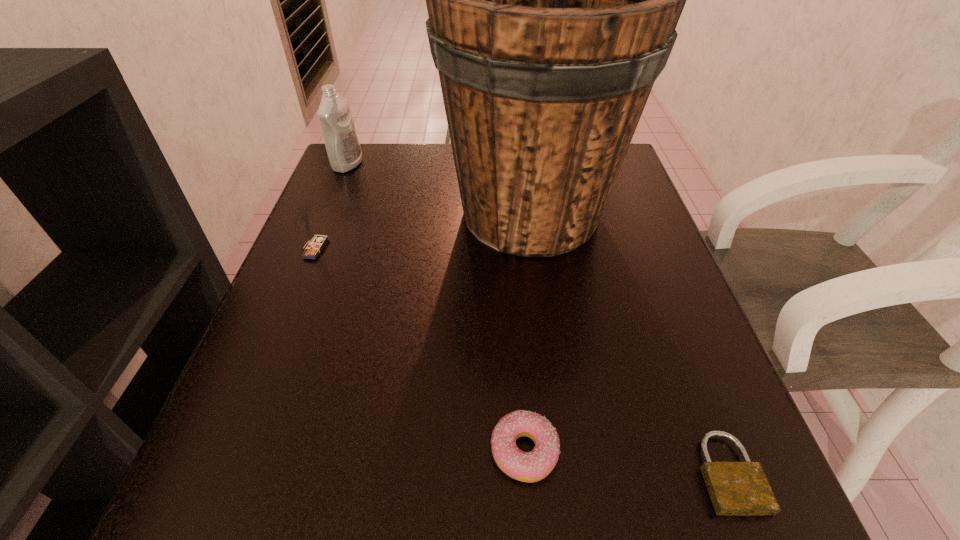
What are the coordinates of `blank region between the bucket and the padlock` in the screenshot? It's located at (629, 342).

This screenshot has width=960, height=540. I want to click on free space between the second shortest object and the bucket, so pos(527,332).

Identify the location of vacant area between the tallest object and the matchbox. (422, 231).

What are the coordinates of `vacant point located between the doughnut and the matchbox` in the screenshot? It's located at (420, 350).

This screenshot has width=960, height=540. I want to click on vacant area that lies between the shortest object and the bucket, so click(629, 342).

Find the location of a particular element. The height and width of the screenshot is (540, 960). blank region between the tallest object and the detergent is located at coordinates (439, 188).

Select which object is the second closest to the fourth tallest object. Please provide its 2D coordinates. Your answer should be formatted as a tuple, i.e. [(x, y)], where the tuple contains the x and y coordinates of a point satisfying the conditions above.

[(553, 0)]

Find the location of `object identified as the third closest to the doughnut`. object identified as the third closest to the doughnut is located at coordinates (315, 246).

Where is `free spot that satisfies the following two spatial constraints: 1. on the back side of the bucket; 2. on the right side of the doughnut`? This screenshot has height=540, width=960. free spot that satisfies the following two spatial constraints: 1. on the back side of the bucket; 2. on the right side of the doughnut is located at coordinates (507, 213).